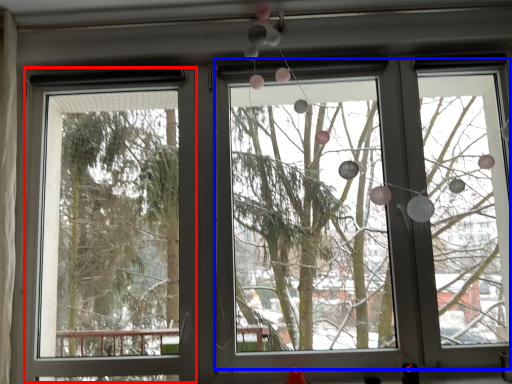
Question: Among these objects, which one is nearest to the camera, screen door (highlighted by a red box) or bay window (highlighted by a blue box)?

Choices:
 (A) screen door
 (B) bay window

Answer: (B)